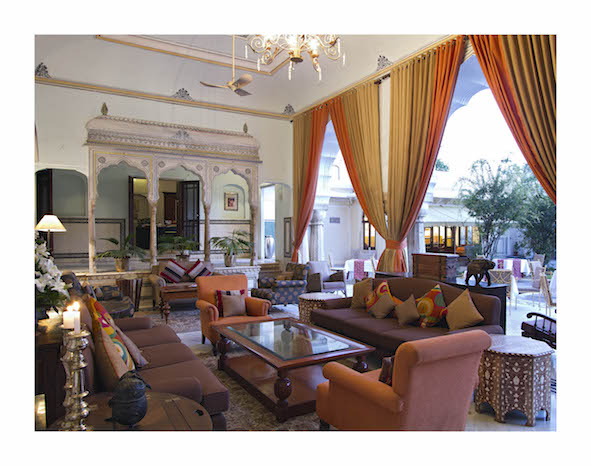
Locate an element on the screen. Image resolution: width=591 pixels, height=466 pixels. coffee table is located at coordinates (285, 336).